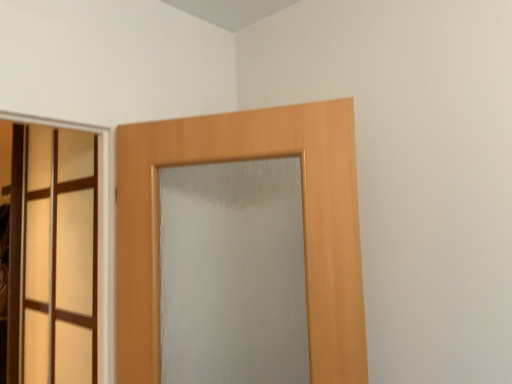
Question: Considering the positions of wooden door at center, the second door from the left, and translucent glass door at left, the first door positioned from the left, in the image, is wooden door at center, the second door from the left, bigger or smaller than translucent glass door at left, the first door positioned from the left,?

Choices:
 (A) big
 (B) small

Answer: (B)

Question: Would you say wooden door at center, which appears as the 1th door when viewed from the right, is inside or outside translucent glass door at left, acting as the second door starting from the right?

Choices:
 (A) outside
 (B) inside

Answer: (A)

Question: In the image, is wooden door at center, which appears as the 1th door when viewed from the right, on the left side or the right side of translucent glass door at left, marked as the 1th door in a back-to-front arrangement?

Choices:
 (A) right
 (B) left

Answer: (A)

Question: From a real-world perspective, is translucent glass door at left, the first door positioned from the left, above or below wooden door at center, the second door from the left?

Choices:
 (A) above
 (B) below

Answer: (B)

Question: Do you think translucent glass door at left, the first door positioned from the left, is within wooden door at center, arranged as the first door when viewed from the front, or outside of it?

Choices:
 (A) outside
 (B) inside

Answer: (A)

Question: In the image, is translucent glass door at left, marked as the 1th door in a back-to-front arrangement, on the left side or the right side of wooden door at center, which appears as the 1th door when viewed from the right?

Choices:
 (A) left
 (B) right

Answer: (A)

Question: From the image's perspective, is translucent glass door at left, marked as the second door in a front-to-back arrangement, located above or below wooden door at center, the second door from the left?

Choices:
 (A) below
 (B) above

Answer: (A)